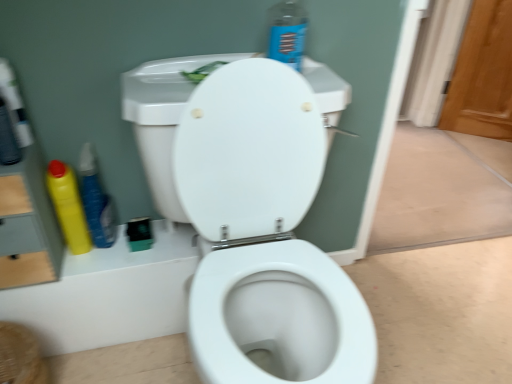
At what (x,y) coordinates should I click in order to perform the action: click on free point in front of yellow plastic bottle at left, which ranks as the second cleaning product in left-to-right order. Please return your answer as a coordinate pair (x, y). Image resolution: width=512 pixels, height=384 pixels. Looking at the image, I should click on (90, 265).